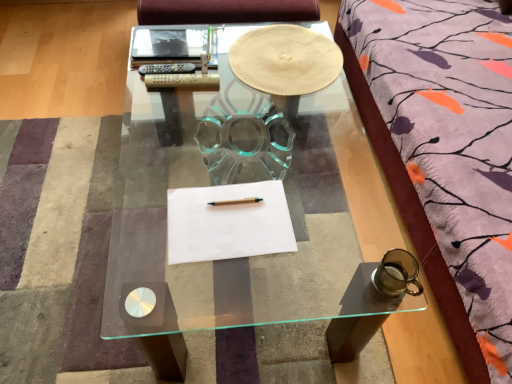
Identify the location of free space to the right of wooden pencil at center. This screenshot has height=384, width=512. (269, 210).